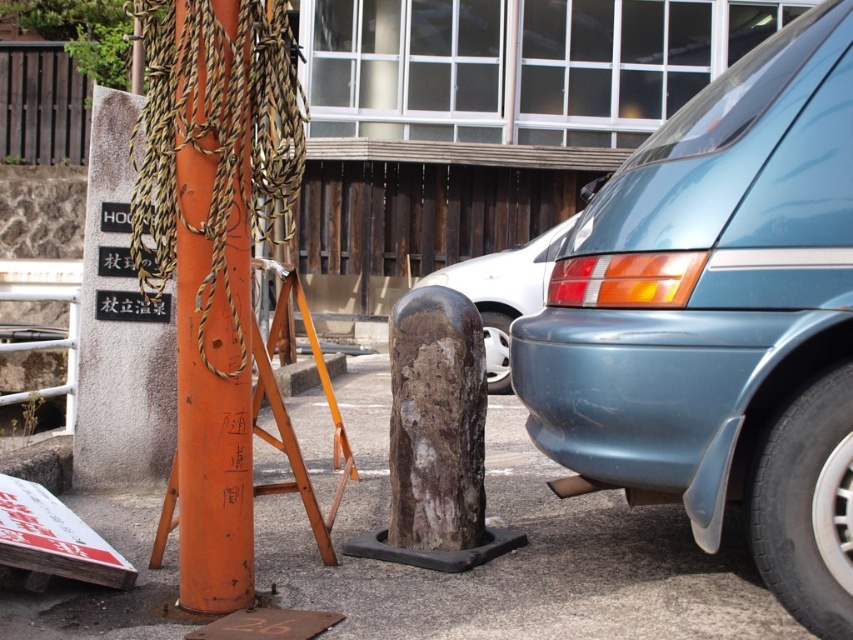
Does teal glossy minivan at right have a greater height compared to orange painted wood post at left?

In fact, teal glossy minivan at right may be shorter than orange painted wood post at left.

Between teal glossy minivan at right and orange painted wood post at left, which one appears on the left side from the viewer's perspective?

From the viewer's perspective, orange painted wood post at left appears more on the left side.

What do you see at coordinates (720, 320) in the screenshot? I see `teal glossy minivan at right` at bounding box center [720, 320].

You are a GUI agent. You are given a task and a screenshot of the screen. Output one action in this format:
    pyautogui.click(x=<x>, y=<y>)
    Task: Click on the teal glossy minivan at right
    
    Given the screenshot: What is the action you would take?
    pyautogui.click(x=720, y=320)

Does point (807, 362) lie in front of point (488, 307)?

Yes.

From the picture: Is teal glossy minivan at right smaller than matte gray bumper at center?

Correct, teal glossy minivan at right occupies less space than matte gray bumper at center.

Does point (668, 140) lie in front of point (506, 381)?

Yes, point (668, 140) is in front of point (506, 381).

Find the location of a particular element. This screenshot has height=640, width=853. teal glossy minivan at right is located at coordinates (720, 320).

Does point (231, 557) lie behind point (505, 360)?

No, (231, 557) is in front of (505, 360).

Which is above, orange painted wood post at left or matte gray bumper at center?

matte gray bumper at center

Is point (194, 497) closer to camera compared to point (468, 273)?

Yes, point (194, 497) is closer to viewer.

Locate an element on the screen. This screenshot has width=853, height=640. orange painted wood post at left is located at coordinates (213, 424).